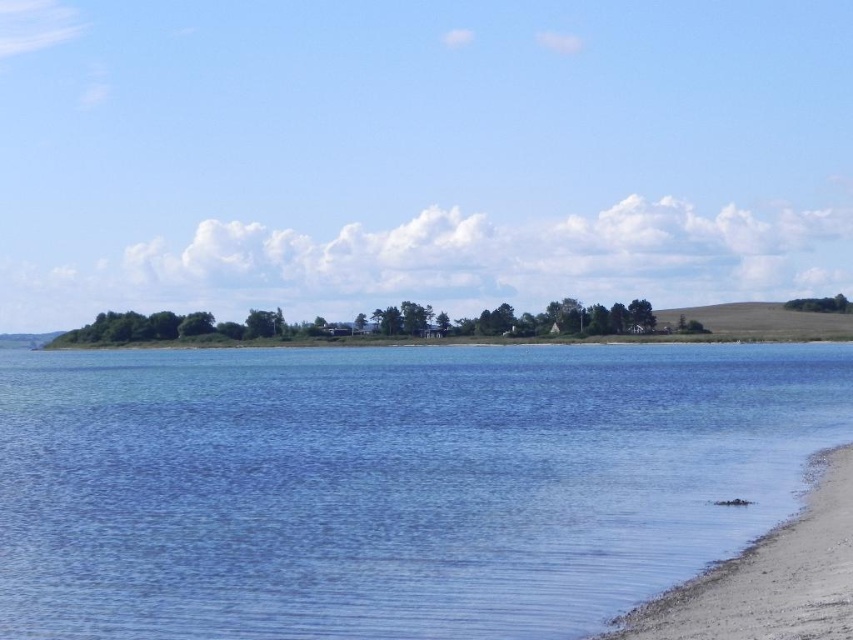
You are standing on the gray gravelly sand at lower right and want to reach the blue water at center. Based on the scene description, which direction should you move to get to the water?

You should move upward towards the blue water at center because it is higher in elevation than the gray gravelly sand at lower right.

You are a photographer planning to capture the blue water at center and the gray gravelly sand at lower right in a single frame. Which of these two elements will occupy more of the image area?

The blue water at center is larger in size than the gray gravelly sand at lower right, so it will occupy more of the image area.

You are standing on the gray gravelly sand at lower right and want to walk towards the blue water at center. Is the water closer to you or farther away?

The blue water at center is farther to the viewer than the gray gravelly sand at lower right, so the water is farther away from you.